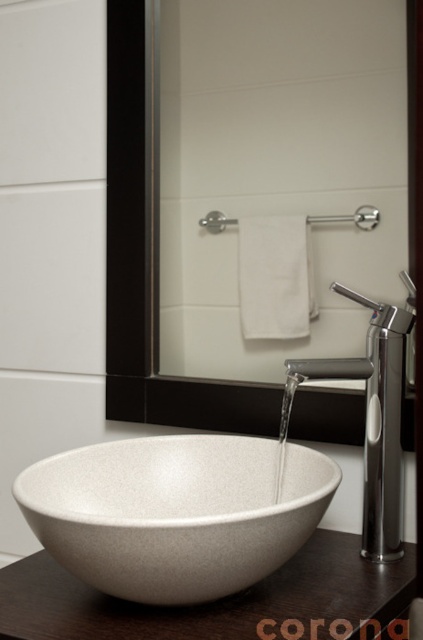
You are a bathroom assistant and need to place a new soap dispenser between the white matte towel at upper center and the white speckled stone sink at center. The soap dispenser is 18 centimeters long. Will it fit without overlapping either object?

The distance between the white matte towel at upper center and the white speckled stone sink at center is 36.36 centimeters. Since the soap dispenser is 18 centimeters long, it will fit comfortably between them without overlapping either object.

You are standing in the bathroom and want to reach the point at coordinates point (186, 253) and point (162, 604). Which point should you approach first if you want to reach the one that is farther away from you?

You should approach point (186, 253) first because it is behind point (162, 604), meaning it is farther away from you.

You are a bathroom designer and want to place a decorative item between the white matte towel at upper center and the white speckled stone sink at center. Given their widths, which object should you place the item closer to?

Since the white matte towel at upper center is narrower than the white speckled stone sink at center, you should place the decorative item closer to the white speckled stone sink at center to maintain balance.